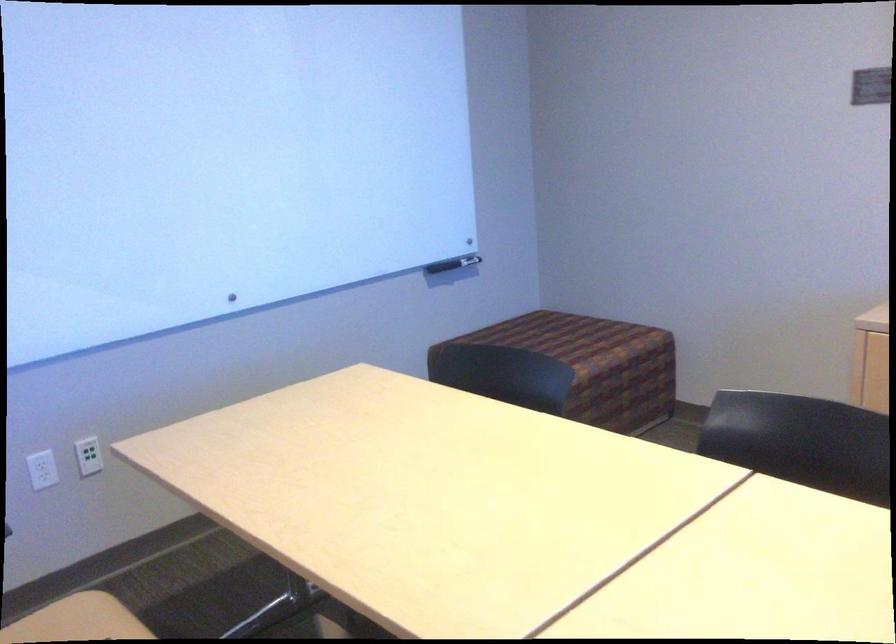
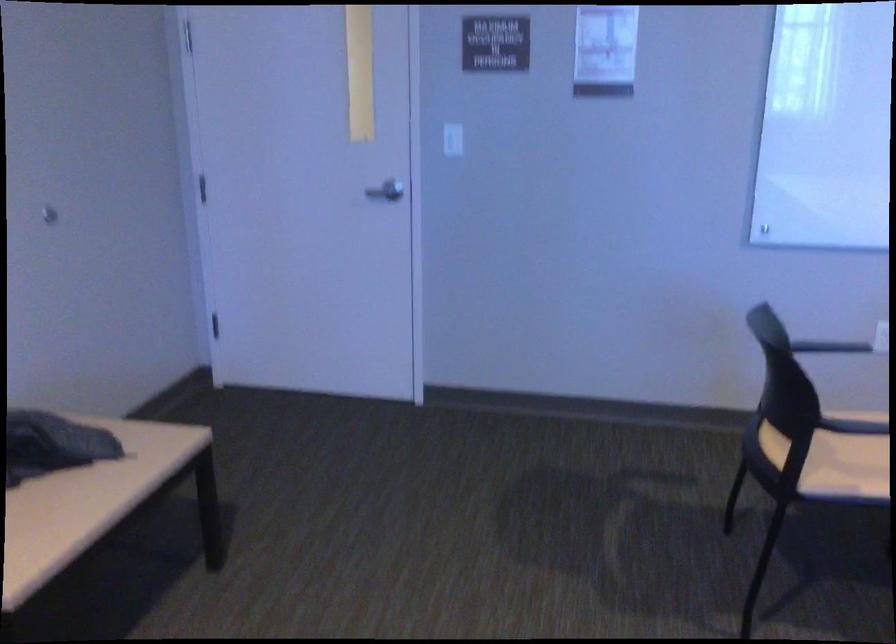
Question: The camera is either moving clockwise (left) or counter-clockwise (right) around the object. The first image is from the beginning of the video and the second image is from the end. Is the camera moving left or right when shooting the video?

Choices:
 (A) Left
 (B) Right

Answer: (B)